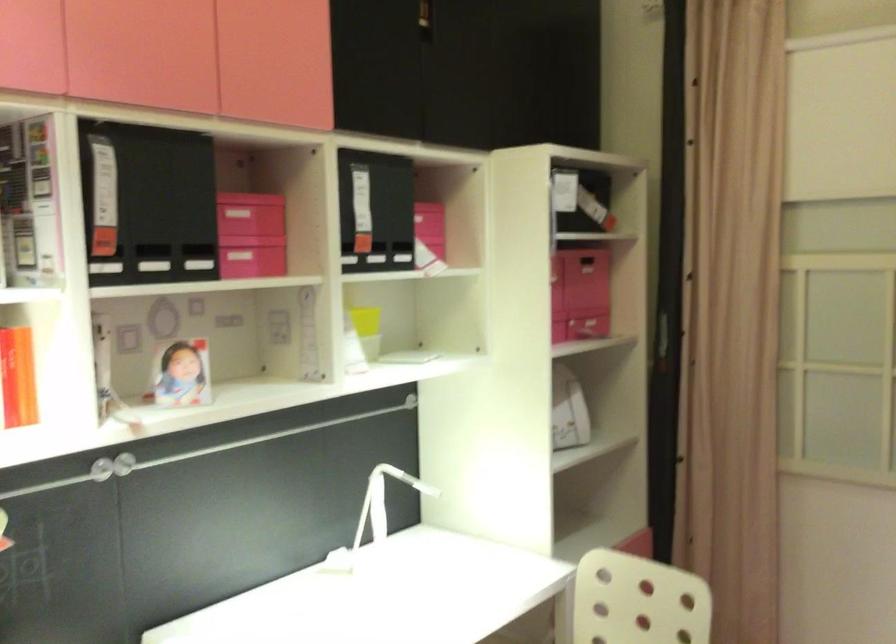
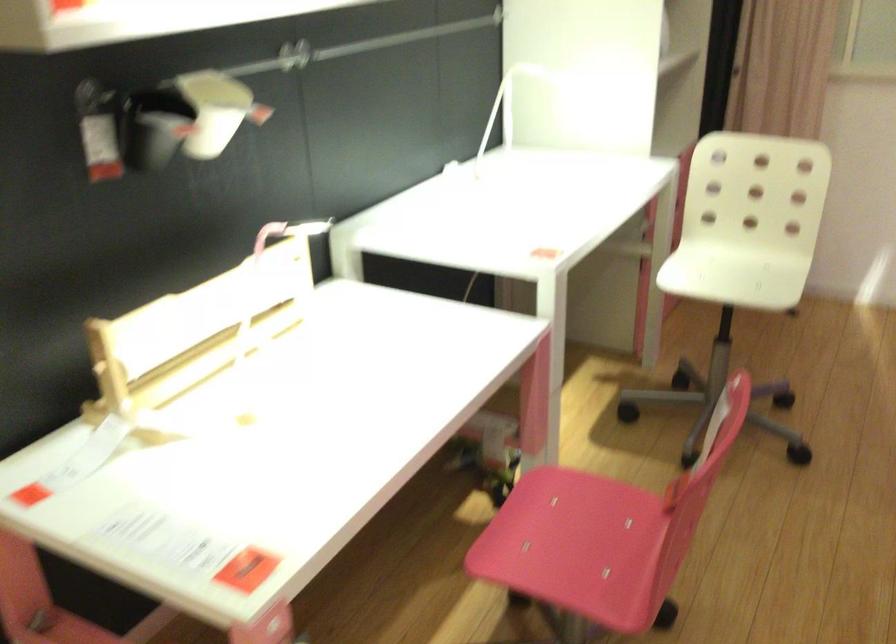
Question: How did the camera likely rotate?

Choices:
 (A) Left
 (B) Right
 (C) Up
 (D) Down

Answer: (D)